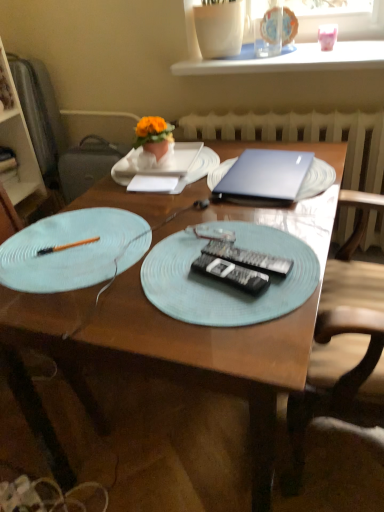
Question: Based on their sizes in the image, would you say black plastic remote control at center, marked as the 1th remote control in a bottom-to-top arrangement, is bigger or smaller than pink glossy piggy bank at upper right, acting as the second tableware starting from the left?

Choices:
 (A) small
 (B) big

Answer: (A)

Question: Relative to pink glossy piggy bank at upper right, acting as the second tableware starting from the left, is black plastic remote control at center, the second remote control in the top-to-bottom sequence, in front or behind?

Choices:
 (A) behind
 (B) front

Answer: (B)

Question: Estimate the real-world distances between objects in this image. Which object is closer to the transparent glass cup at upper center, which is counted as the second tableware, starting from the right?

Choices:
 (A) pink glossy piggy bank at upper right, acting as the first tableware starting from the right
 (B) black plastic remote control at center, marked as the 1th remote control in a bottom-to-top arrangement
 (C) blue textured placemat at center, the 3th plate viewed from the back
 (D) white paper plate at center, which is the 1th plate in back-to-front order
 (E) wooden table at center

Answer: (A)

Question: Considering the real-world distances, which object is closest to the orange fabric flower at upper center?

Choices:
 (A) white ceramic vase at upper center
 (B) wooden table at center
 (C) pink glossy piggy bank at upper right, acting as the first tableware starting from the right
 (D) black plastic remote control at center, marked as the 1th remote control in a bottom-to-top arrangement
 (E) white wooden bookshelf at left

Answer: (B)